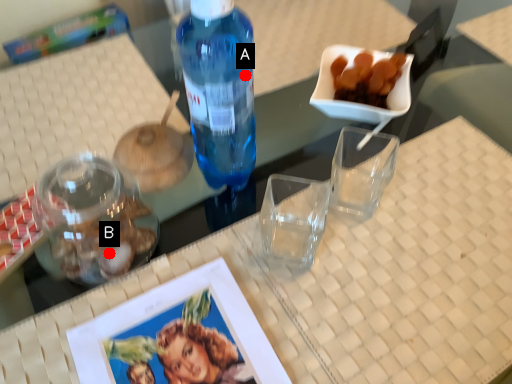
Question: Two points are circled on the image, labeled by A and B beside each circle. Which point is closer to the camera taking this photo?

Choices:
 (A) A is closer
 (B) B is closer

Answer: (A)